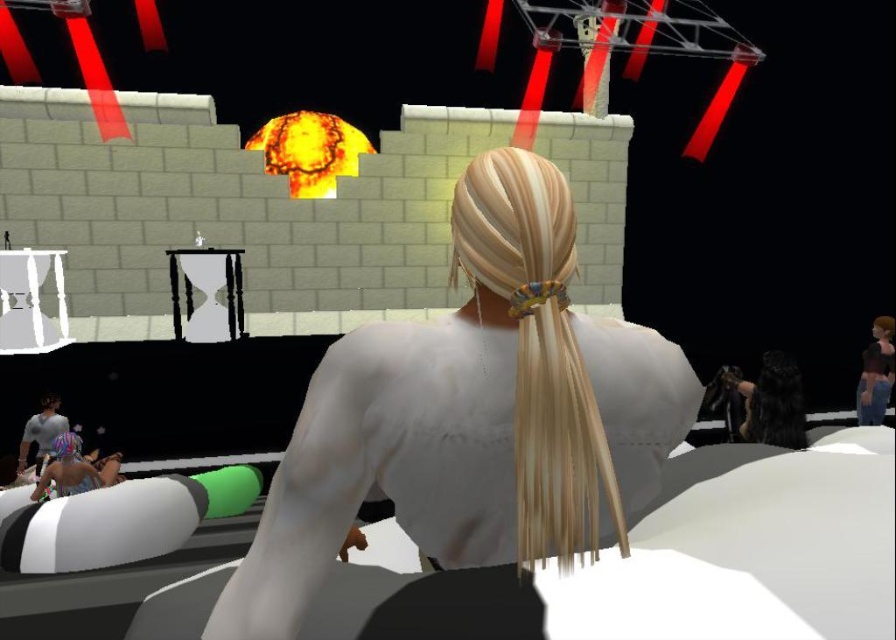
Question: Can you confirm if white matte hair at center is positioned below shiny black hair at center?

Choices:
 (A) yes
 (B) no

Answer: (B)

Question: Is shiny black hair at center thinner than matte blue swimsuit at lower left?

Choices:
 (A) no
 (B) yes

Answer: (B)

Question: Which of the following is the closest to the observer?

Choices:
 (A) (50, 481)
 (B) (270, 595)
 (C) (541, 496)

Answer: (C)

Question: Estimate the real-world distances between objects in this image. Which object is closer to the white matte hair at center?

Choices:
 (A) shiny black hair at center
 (B) blonde silky hair at center

Answer: (B)

Question: Which of the following is the farthest from the observer?

Choices:
 (A) (535, 518)
 (B) (78, 445)
 (C) (652, 481)

Answer: (B)

Question: Does white matte hair at center appear over matte blue swimsuit at lower left?

Choices:
 (A) no
 (B) yes

Answer: (B)